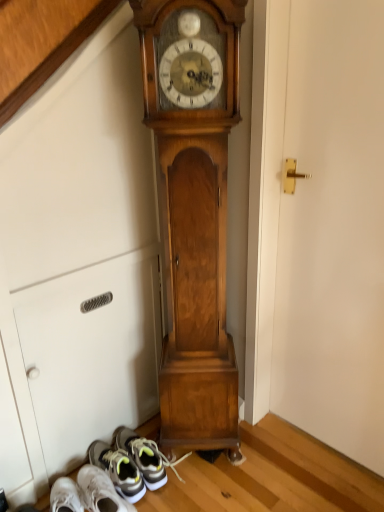
Measure the distance between point (338,163) and camera.

Point (338,163) and camera are 4.11 feet apart.

This screenshot has height=512, width=384. Describe the element at coordinates (113, 476) in the screenshot. I see `gray fabric sneaker at lower left` at that location.

I want to click on wooden grandfather clock at center, so click(x=195, y=233).

Which object is positioned more to the right, wooden grandfather clock at center or white matte door at center right?

From the viewer's perspective, white matte door at center right appears more on the right side.

From a real-world perspective, which is physically below, wooden grandfather clock at center or white matte door at center right?

white matte door at center right.

From the image's perspective, which object appears higher, wooden grandfather clock at center or white matte door at center right?

wooden grandfather clock at center, from the image's perspective.

Is wooden grandfather clock at center completely or partially outside of white matte door at center right?

That's correct, wooden grandfather clock at center is outside of white matte door at center right.

From the image's perspective, which one is positioned lower, white matte door at center right or gray fabric sneaker at lower left?

gray fabric sneaker at lower left is shown below in the image.

Does white matte door at center right touch gray fabric sneaker at lower left?

white matte door at center right and gray fabric sneaker at lower left are not in contact.

Who is shorter, white matte door at center right or gray fabric sneaker at lower left?

gray fabric sneaker at lower left is shorter.

From a real-world perspective, which object stands above the other?

wooden grandfather clock at center is physically above.

Considering the relative positions of white matte door at center right and wooden grandfather clock at center in the image provided, is white matte door at center right in front of wooden grandfather clock at center?

Yes, the depth of white matte door at center right is less than that of wooden grandfather clock at center.

In the scene shown: Is white matte door at center right aimed at wooden grandfather clock at center?

No, white matte door at center right is not turned towards wooden grandfather clock at center.

Is white matte door at center right shorter than wooden grandfather clock at center?

Correct, white matte door at center right is not as tall as wooden grandfather clock at center.

From their relative heights in the image, would you say wooden grandfather clock at center is taller or shorter than gray fabric sneaker at lower left?

In the image, wooden grandfather clock at center appears to be taller than gray fabric sneaker at lower left.

Is wooden grandfather clock at center oriented towards gray fabric sneaker at lower left?

No, wooden grandfather clock at center is not facing towards gray fabric sneaker at lower left.

How different are the orientations of wooden grandfather clock at center and gray fabric sneaker at lower left in degrees?

The angle between the facing direction of wooden grandfather clock at center and the facing direction of gray fabric sneaker at lower left is 43.6 degrees.

Can you confirm if wooden grandfather clock at center is positioned to the left of gray fabric sneaker at lower left?

No.

Could you tell me if gray fabric sneaker at lower left is turned towards wooden grandfather clock at center?

No, gray fabric sneaker at lower left is not turned towards wooden grandfather clock at center.

Can we say gray fabric sneaker at lower left lies outside wooden grandfather clock at center?

Yes, gray fabric sneaker at lower left is not within wooden grandfather clock at center.

Looking at this image, who is taller, gray fabric sneaker at lower left or wooden grandfather clock at center?

Standing taller between the two is wooden grandfather clock at center.

Is point (160, 487) positioned after point (301, 3)?

Yes, it is.

Does gray fabric sneaker at lower left appear on the right side of white matte door at center right?

In fact, gray fabric sneaker at lower left is to the left of white matte door at center right.

Which of these two, gray fabric sneaker at lower left or white matte door at center right, is smaller?

gray fabric sneaker at lower left is smaller.

Find the location of a particular element. This screenshot has width=384, height=512. wall clock above the white matte door at center right (from the image's perspective) is located at coordinates (195, 233).

At what (x,y) coordinates should I click in order to perform the action: click on shoe to the left of white matte door at center right. Please return your answer as a coordinate pair (x, y). Looking at the image, I should click on (113, 476).

Which object lies nearer to the anchor point white matte door at center right, gray fabric sneaker at lower left or wooden grandfather clock at center?

wooden grandfather clock at center lies closer to white matte door at center right than the other object.

From the image, which object appears to be nearer to white matte door at center right, wooden grandfather clock at center or gray fabric sneaker at lower left?

wooden grandfather clock at center.

Which object lies nearer to the anchor point gray fabric sneaker at lower left, wooden grandfather clock at center or white matte door at center right?

Based on the image, wooden grandfather clock at center appears to be nearer to gray fabric sneaker at lower left.

Considering their positions, is white matte door at center right positioned closer to gray fabric sneaker at lower left than wooden grandfather clock at center?

The object closer to gray fabric sneaker at lower left is wooden grandfather clock at center.

Based on their spatial positions, is white matte door at center right or gray fabric sneaker at lower left further from wooden grandfather clock at center?

Based on the image, gray fabric sneaker at lower left appears to be further to wooden grandfather clock at center.

Looking at the image, which one is located closer to wooden grandfather clock at center, gray fabric sneaker at lower left or white matte door at center right?

Among the two, white matte door at center right is located nearer to wooden grandfather clock at center.

The height and width of the screenshot is (512, 384). I want to click on door between wooden grandfather clock at center and gray fabric sneaker at lower left in the up-down direction, so click(333, 231).